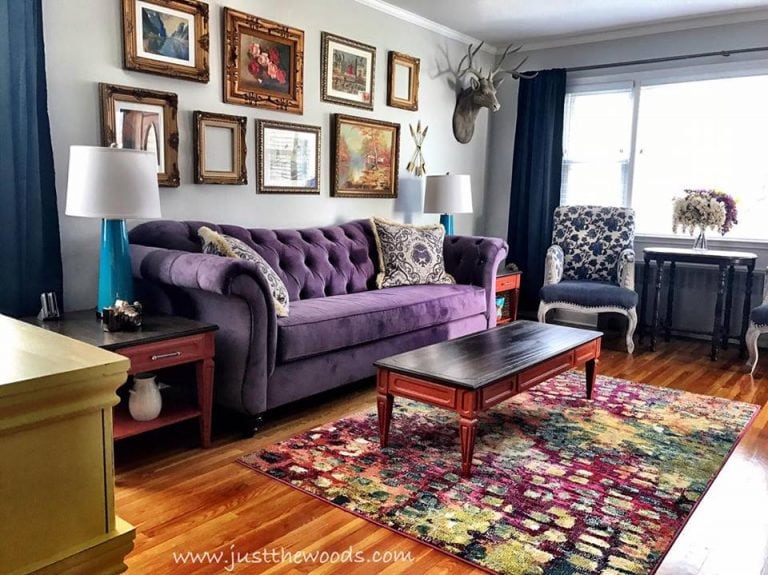
The image size is (768, 575). What are the coordinates of `dark blue curtains` in the screenshot? It's located at (21, 214), (537, 156).